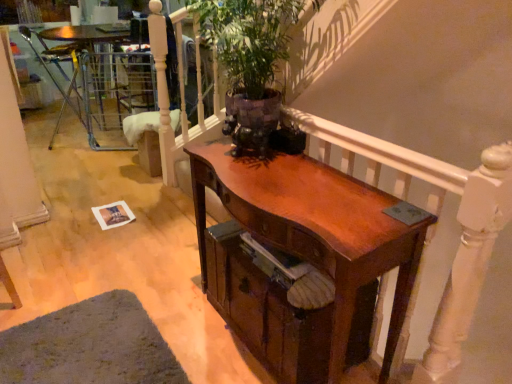
Where is `vacant area situated to the left side of wooden drawer at center`? This screenshot has height=384, width=512. vacant area situated to the left side of wooden drawer at center is located at coordinates (185, 313).